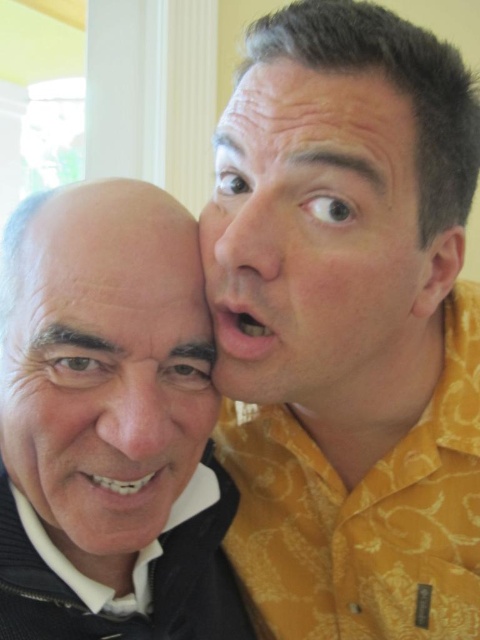
You are holding a camera and want to take a photo of the scene. The camera is currently positioned at point (415, 508). To ensure the entire scene is captured, you need to adjust your distance. What is the minimum distance you should maintain from the camera to the scene to avoid cropping any part of the image?

The minimum distance you should maintain from the camera to the scene is 25.41 inches to ensure the entire scene is captured without cropping.

You are a photographer adjusting the focus on a camera. You want to ensure both the black knitwear at lower left and the smooth skin nose at center are in focus. Which object should you focus on first to achieve this?

You should focus on the black knitwear at lower left first because it is closer to the viewer than the smooth skin nose at center. By focusing on the closer object, the farther one will also come into focus if within the depth of field.

You are standing at the origin point in the image and want to reach the point at the bottom right corner. Which point should you pass through first, point (320, 70) or point (82, 577)?

You should pass through point (320, 70) first because it is in front of point (82, 577) from your starting position at the origin.